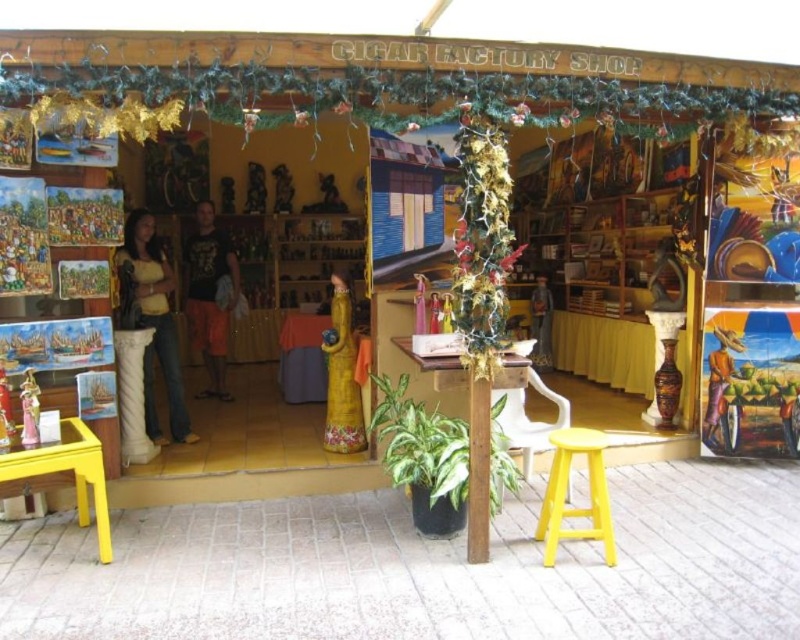
You are standing at the entrance of the Cigar Factory Shop and see a pair of jeans displayed at point (152, 321). The shop has a small wooden table with a yellow stool in front of it. Where is the jeans located relative to the table?

The jeans at left are located to the left of the table.